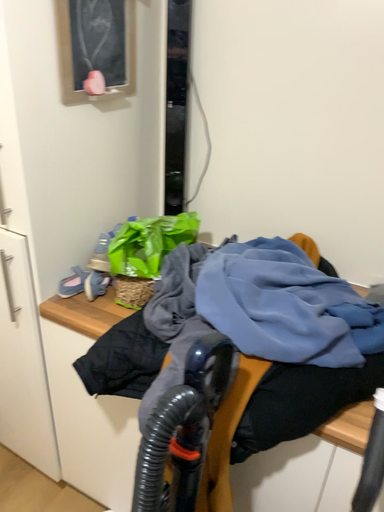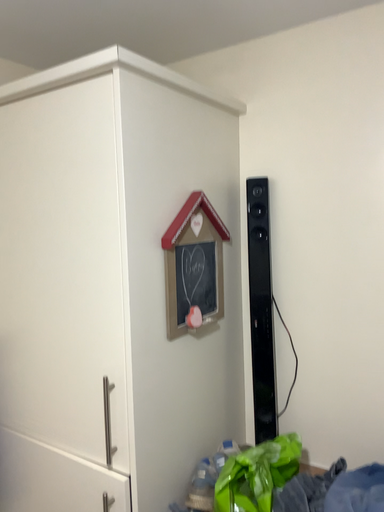
Question: Which way did the camera rotate in the video?

Choices:
 (A) rotated upward
 (B) rotated downward

Answer: (A)